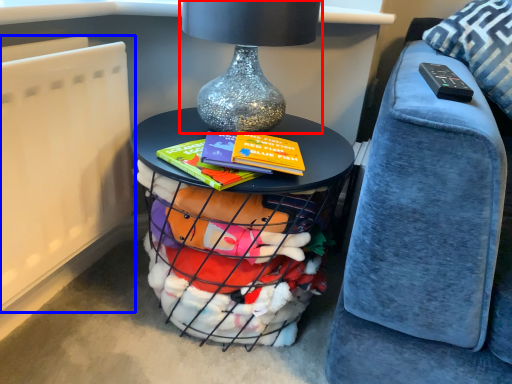
Question: Which object is closer to the camera taking this photo, table lamp (highlighted by a red box) or radiator (highlighted by a blue box)?

Choices:
 (A) table lamp
 (B) radiator

Answer: (B)